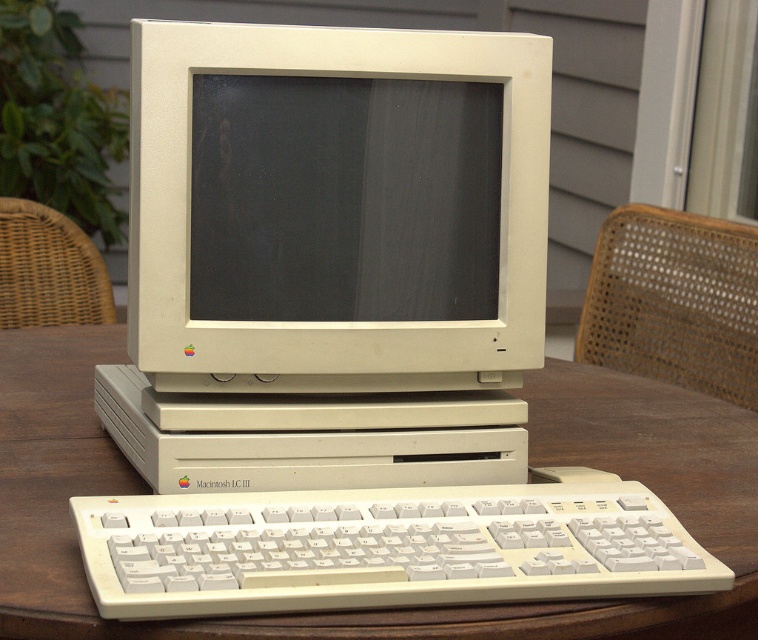
What do you see at coordinates (330, 257) in the screenshot? The image size is (758, 640). I see `white plastic monitor at center` at bounding box center [330, 257].

Which is in front, point (420, 164) or point (503, 595)?

Positioned in front is point (503, 595).

Which is in front, point (403, 298) or point (371, 579)?

Positioned in front is point (371, 579).

Where is `white plastic monitor at center`? This screenshot has width=758, height=640. white plastic monitor at center is located at coordinates (330, 257).

In the scene shown: Can you confirm if white plastic monitor at center is smaller than wooden table at center?

Correct, white plastic monitor at center occupies less space than wooden table at center.

Which is above, white plastic monitor at center or wooden table at center?

Positioned higher is white plastic monitor at center.

The image size is (758, 640). Describe the element at coordinates (330, 257) in the screenshot. I see `white plastic monitor at center` at that location.

Where is `white plastic monitor at center`? The image size is (758, 640). white plastic monitor at center is located at coordinates (330, 257).

Does wooden table at center appear over black matte screen at center?

No.

Is point (749, 420) in front of point (343, 218)?

No, (749, 420) is further to viewer.

At what (x,y) coordinates should I click in order to perform the action: click on wooden table at center. Please return your answer as a coordinate pair (x, y). Looking at the image, I should click on (381, 609).